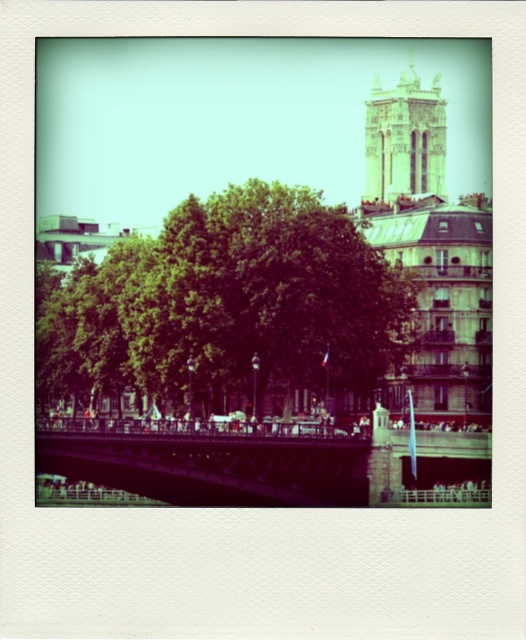
Question: Is the position of green leafy tree at center less distant than that of metallic bridge at center?

Choices:
 (A) no
 (B) yes

Answer: (A)

Question: Among these objects, which one is farthest from the camera?

Choices:
 (A) golden stone bell tower at upper right
 (B) green leafy tree at center
 (C) metallic bridge at center

Answer: (A)

Question: Can you confirm if green leafy tree at center is wider than golden stone bell tower at upper right?

Choices:
 (A) yes
 (B) no

Answer: (A)

Question: Among these objects, which one is farthest from the camera?

Choices:
 (A) metallic bridge at center
 (B) green leafy tree at center

Answer: (B)

Question: Can you confirm if green leafy tree at center is wider than golden stone bell tower at upper right?

Choices:
 (A) yes
 (B) no

Answer: (A)

Question: Which object is closer to the camera taking this photo?

Choices:
 (A) golden stone bell tower at upper right
 (B) green leafy tree at center
 (C) metallic bridge at center

Answer: (C)